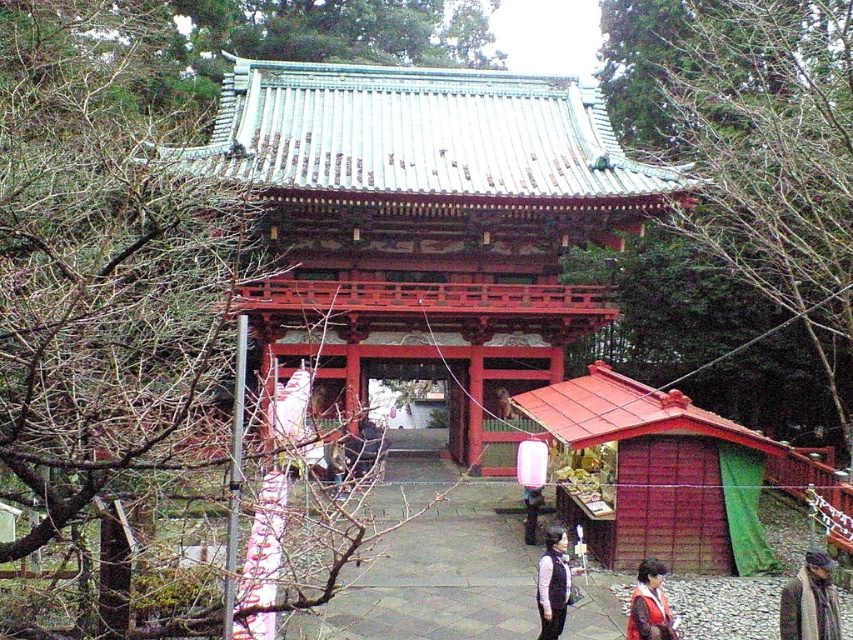
Question: Is shiny red wooden gate at center wider than matte black vest at center?

Choices:
 (A) yes
 (B) no

Answer: (A)

Question: Which point is closer to the camera?

Choices:
 (A) (314, 620)
 (B) (469, 412)

Answer: (A)

Question: Based on their relative distances, which object is farther from the shiny red wooden gate at center?

Choices:
 (A) matte black vest at center
 (B) smooth red wooden gate at center
 (C) smooth stone path at center
 (D) red velvet coat at lower right

Answer: (D)

Question: Is smooth stone path at center bigger than matte black vest at center?

Choices:
 (A) no
 (B) yes

Answer: (B)

Question: Estimate the real-world distances between objects in this image. Which object is closer to the matte black vest at center?

Choices:
 (A) smooth red wooden gate at center
 (B) smooth stone path at center

Answer: (B)

Question: Does shiny red wooden gate at center have a lesser width compared to knitted scarf at lower right?

Choices:
 (A) no
 (B) yes

Answer: (A)